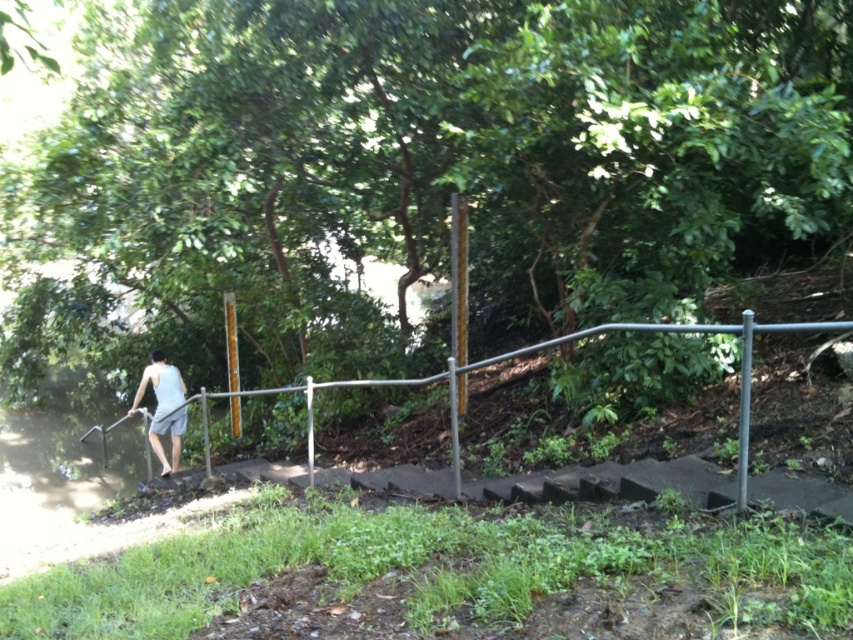
Is silver metallic rail at center shorter than light gray tank top at left?

In fact, silver metallic rail at center may be taller than light gray tank top at left.

Who is shorter, silver metallic rail at center or light gray tank top at left?

With less height is light gray tank top at left.

The width and height of the screenshot is (853, 640). Describe the element at coordinates (514, 356) in the screenshot. I see `silver metallic rail at center` at that location.

You are a GUI agent. You are given a task and a screenshot of the screen. Output one action in this format:
    pyautogui.click(x=<x>, y=<y>)
    Task: Click on the silver metallic rail at center
    Image resolution: width=853 pixels, height=640 pixels.
    Given the screenshot: What is the action you would take?
    pyautogui.click(x=514, y=356)